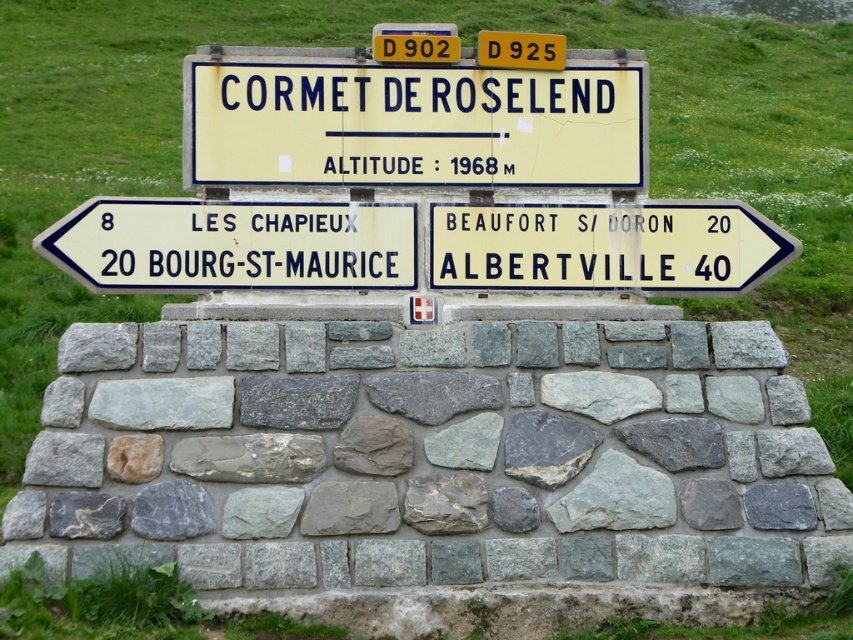
Question: Is gray stone wall at center to the right of white plastic sign at right from the viewer's perspective?

Choices:
 (A) yes
 (B) no

Answer: (B)

Question: Which point appears closest to the camera in this image?

Choices:
 (A) (138, 468)
 (B) (573, 99)
 (C) (97, 234)

Answer: (A)

Question: Which object appears closest to the camera in this image?

Choices:
 (A) white plastic sign at right
 (B) white plastic sign at left

Answer: (B)

Question: Is gray stone wall at center wider than white plastic sign at left?

Choices:
 (A) no
 (B) yes

Answer: (A)

Question: Which point is farther to the camera?

Choices:
 (A) white plastic sign at right
 (B) gray stone wall at center
 (C) yellow plastic sign at center
 (D) white plastic sign at left

Answer: (A)

Question: Does yellow plastic sign at center have a lesser width compared to white plastic sign at left?

Choices:
 (A) no
 (B) yes

Answer: (A)